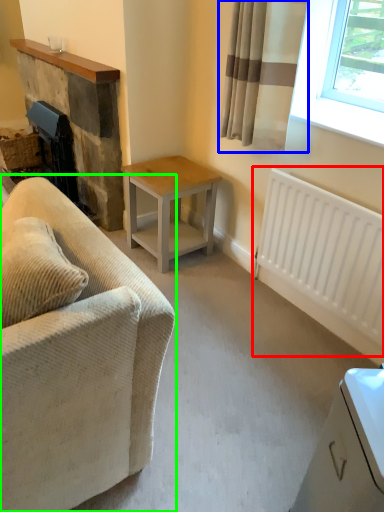
Question: Which is farther away from radiator (highlighted by a red box)? curtain (highlighted by a blue box) or studio couch (highlighted by a green box)?

Choices:
 (A) curtain
 (B) studio couch

Answer: (B)